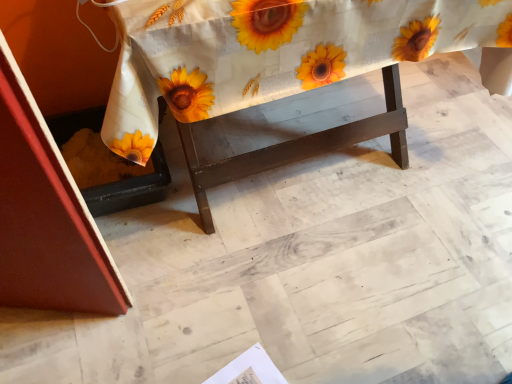
In order to click on vacant area in front of wooden table at center in this screenshot , I will do coord(291,302).